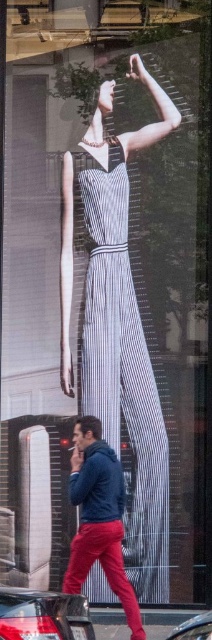
Is matte blue hoodie at center above metallic silver car at lower center?

Correct, matte blue hoodie at center is located above metallic silver car at lower center.

Between matte blue hoodie at center and metallic silver car at lower center, which one is positioned higher?

matte blue hoodie at center is higher up.

Between point (80, 436) and point (203, 616), which one is positioned in front?

Point (203, 616) is in front.

At what (x,y) coordinates should I click in order to perform the action: click on matte blue hoodie at center. Please return your answer as a coordinate pair (x, y). This screenshot has width=212, height=640. Looking at the image, I should click on (99, 516).

Is the position of white striped jumpsuit at center less distant than that of matte blue hoodie at center?

No, white striped jumpsuit at center is behind matte blue hoodie at center.

Between point (103, 312) and point (136, 608), which one is positioned behind?

The point (103, 312) is more distant.

Locate an element on the screen. The width and height of the screenshot is (212, 640). white striped jumpsuit at center is located at coordinates (124, 376).

Between point (159, 588) and point (11, 616), which one is positioned in front?

Positioned in front is point (11, 616).

In the scene shown: Does white striped jumpsuit at center lie in front of shiny black car at lower left?

No, it is behind shiny black car at lower left.

I want to click on white striped jumpsuit at center, so click(124, 376).